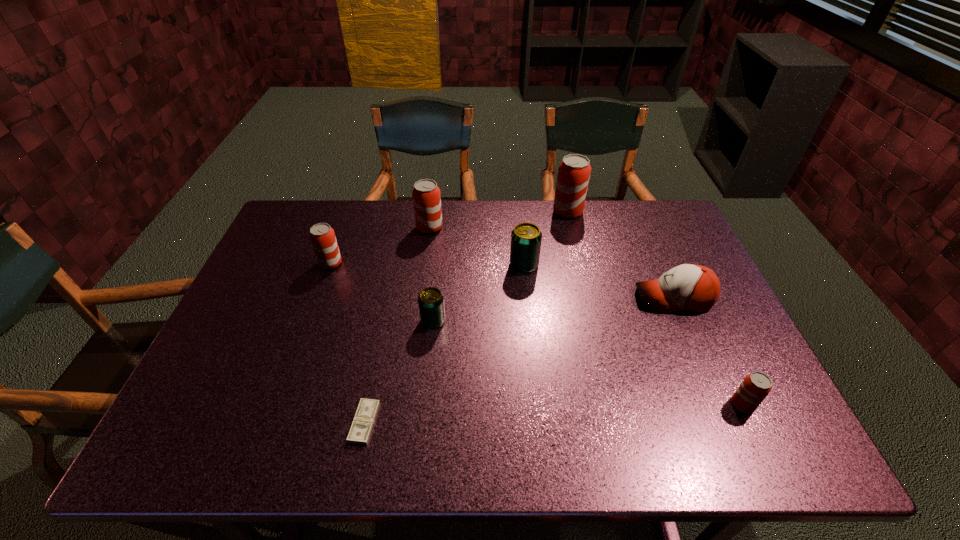
Image resolution: width=960 pixels, height=540 pixels. In order to click on empty space between the baseball cap and the nearest beer can in this screenshot , I will do click(x=708, y=351).

Where is `free spot between the third farthest orange beer can and the nearer green beer can`? free spot between the third farthest orange beer can and the nearer green beer can is located at coordinates [382, 292].

What are the coordinates of `vacant region between the second tallest object and the orange baseball cap` in the screenshot? It's located at (552, 263).

I want to click on unoccupied position between the fourth beer can from left to right and the second orange beer can from right to left, so click(x=546, y=238).

What are the coordinates of `object that is the third closest to the leftmost orange beer can` in the screenshot? It's located at (361, 428).

The height and width of the screenshot is (540, 960). I want to click on the fourth closest object relative to the second tallest object, so click(574, 171).

Identify which beer can is the fourth nearest to the leftmost orange beer can. Please provide its 2D coordinates. Your answer should be formatted as a tuple, i.e. [(x, y)], where the tuple contains the x and y coordinates of a point satisfying the conditions above.

[(574, 171)]

This screenshot has width=960, height=540. Find the location of `the second closest beer can to the seventh object from right to left`. the second closest beer can to the seventh object from right to left is located at coordinates (322, 236).

The width and height of the screenshot is (960, 540). Identify the location of orange beer can that is the closest one to the tallest beer can. (426, 195).

Identify which orange beer can is located as the second nearest to the left green beer can. Please provide its 2D coordinates. Your answer should be formatted as a tuple, i.e. [(x, y)], where the tuple contains the x and y coordinates of a point satisfying the conditions above.

[(426, 195)]